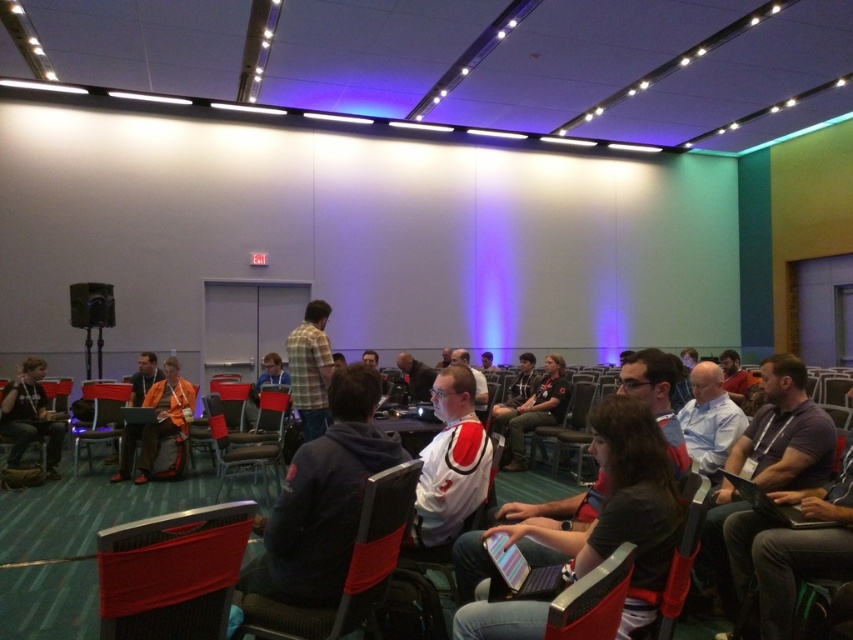
Who is more forward, (138, 595) or (370, 502)?

Positioned in front is point (138, 595).

Is the position of red fabric chair at lower left less distant than that of black fabric chair at center?

Yes.

Is point (194, 636) in front of point (402, 516)?

That is True.

Where is `red fabric chair at lower left`? Image resolution: width=853 pixels, height=640 pixels. red fabric chair at lower left is located at coordinates (171, 572).

Can you confirm if plaid shirt at center is positioned below matte black hoodie at left?

No.

Is plaid shirt at center wider than matte black hoodie at left?

Incorrect, plaid shirt at center's width does not surpass matte black hoodie at left's.

Between point (300, 372) and point (26, 416), which one is positioned behind?

The point (26, 416) is more distant.

Where is `plaid shirt at center`? plaid shirt at center is located at coordinates (310, 369).

Does white jersey at center come in front of metallic silver speaker at left?

Yes, white jersey at center is in front of metallic silver speaker at left.

Does white jersey at center have a lesser height compared to metallic silver speaker at left?

In fact, white jersey at center may be taller than metallic silver speaker at left.

Describe the element at coordinates (450, 465) in the screenshot. This screenshot has height=640, width=853. I see `white jersey at center` at that location.

In order to click on white jersey at center in this screenshot , I will do `click(450, 465)`.